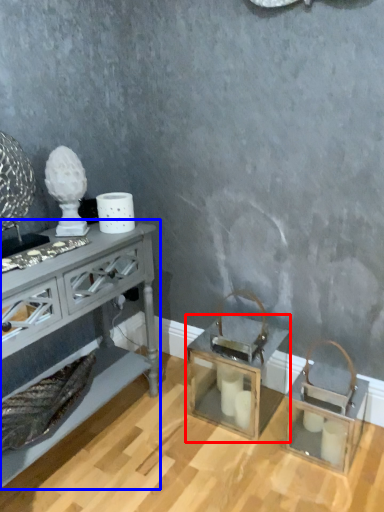
Question: Among these objects, which one is nearest to the camera, table (highlighted by a red box) or table (highlighted by a blue box)?

Choices:
 (A) table
 (B) table

Answer: (B)